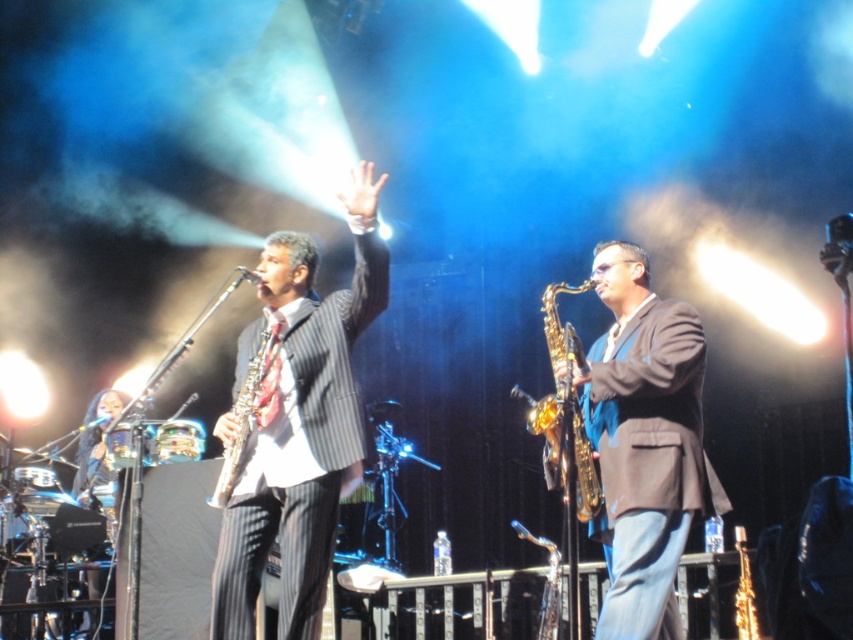
You are a photographer capturing the stage performance. You need to frame a shot that includes both the pinstripe suit at center and the shiny gold saxophone at center. Based on their sizes, which object will occupy more space in the photo?

The pinstripe suit at center will occupy more space in the photo since its width surpasses that of the shiny gold saxophone at center.

You are a stagehand adjusting the lighting for the performance. You need to ensure that the pinstripe suit at center and the shiny gold saxophone at center are both well lit. Given their sizes, which object requires a larger spotlight to properly illuminate it?

The pinstripe suit at center requires a larger spotlight because it is larger in size than the shiny gold saxophone at center.

Based on the photo, you are a photographer trying to capture a closeup of the pinstripe suit at center and the gold shiny saxophone at center during the performance. Given that your camera can only focus on one object at a time, which object should you prioritize to ensure it fills more of the frame?

The pinstripe suit at center is larger in size than the gold shiny saxophone at center, so you should prioritize focusing on the pinstripe suit at center to ensure it fills more of the frame.